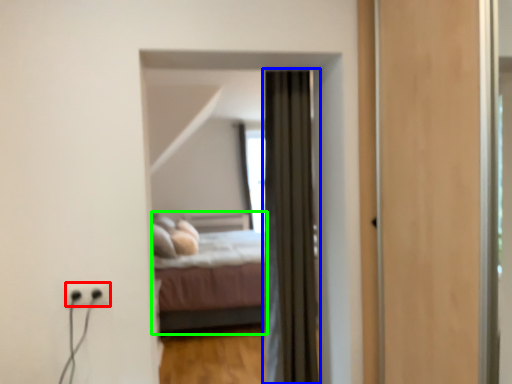
Question: Based on their relative distances, which object is nearer to electric outlet (highlighted by a red box)? Choose from curtain (highlighted by a blue box) and bed (highlighted by a green box).

Choices:
 (A) curtain
 (B) bed

Answer: (A)